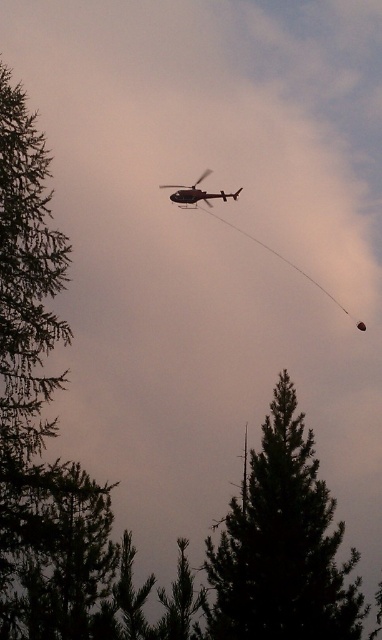
Question: Does dark green textured tree at center have a larger size compared to metallic silver helicopter at upper center?

Choices:
 (A) no
 (B) yes

Answer: (B)

Question: Which of the following is the closest to the observer?

Choices:
 (A) metallic silver helicopter at upper center
 (B) dark green textured tree at center

Answer: (B)

Question: Is dark green textured tree at center thinner than metallic silver helicopter at upper center?

Choices:
 (A) yes
 (B) no

Answer: (B)

Question: Among these points, which one is nearest to the camera?

Choices:
 (A) (271, 618)
 (B) (205, 173)

Answer: (A)

Question: Can you confirm if dark green textured tree at center is smaller than metallic silver helicopter at upper center?

Choices:
 (A) yes
 (B) no

Answer: (B)